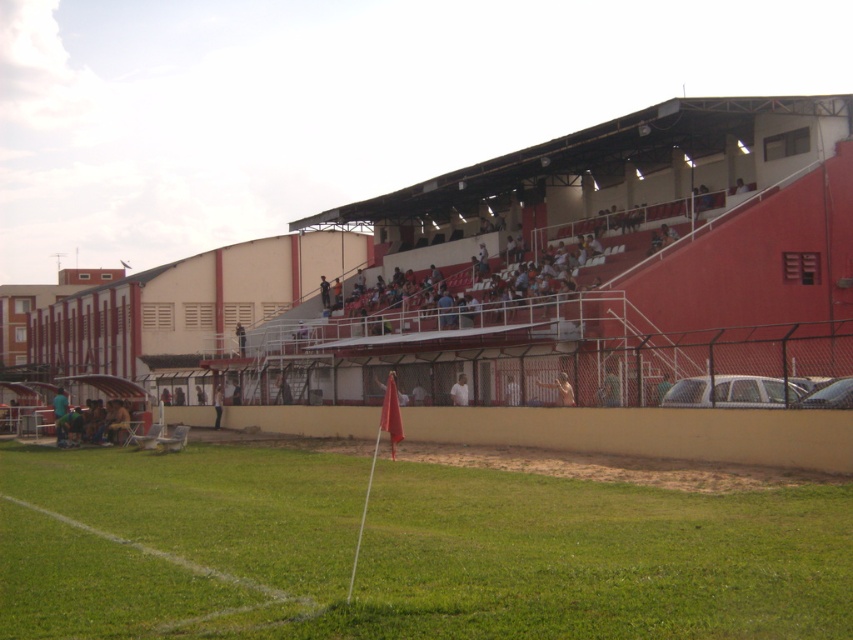
Question: Estimate the real-world distances between objects in this image. Which object is farther from the red plastic stadium at upper center?

Choices:
 (A) green fabric chairs at lower left
 (B) light brown wooden chair at center
 (C) white matte shirt at center
 (D) smooth skin person at center

Answer: (A)

Question: Does green grass at center have a larger size compared to green fabric chairs at lower left?

Choices:
 (A) no
 (B) yes

Answer: (B)

Question: Considering the real-world distances, which object is farthest from the smooth skin person at center?

Choices:
 (A) red plastic stadium at upper center
 (B) green fabric chairs at lower left
 (C) light brown wooden chair at center
 (D) green grass at center

Answer: (A)

Question: Can you confirm if green grass at center is positioned above light brown wooden chair at center?

Choices:
 (A) yes
 (B) no

Answer: (A)

Question: Among these objects, which one is nearest to the camera?

Choices:
 (A) green grass at center
 (B) white matte shirt at center

Answer: (A)

Question: Can you confirm if green grass at center is thinner than green fabric chairs at lower left?

Choices:
 (A) no
 (B) yes

Answer: (A)